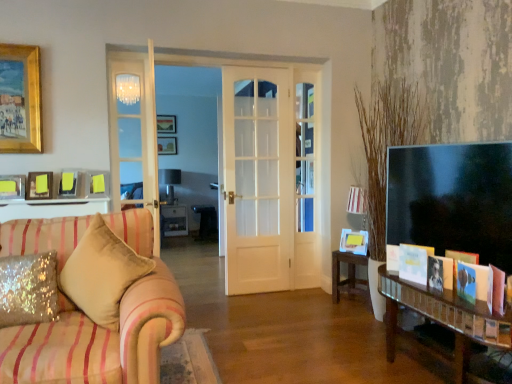
Find the location of `wooden table at center, which ranks as the second table in back-to-front order`. wooden table at center, which ranks as the second table in back-to-front order is located at coordinates pos(348,276).

Measure the distance between point (406, 247) and camera.

Point (406, 247) and camera are 7.77 feet apart.

Measure the distance between metallic silver lamp at center and camera.

metallic silver lamp at center is 6.96 meters from camera.

This screenshot has height=384, width=512. I want to click on wooden picture frame at upper center, the second picture frame from the left, so click(166, 124).

Describe the element at coordinates (166, 124) in the screenshot. I see `wooden picture frame at upper center, which is the 6th picture frame in bottom-to-top order` at that location.

Locate an element on the screen. velvet beige pillow at left, the 1th pillow viewed from the right is located at coordinates (102, 273).

Where is `matte gold picture frame at upper left, which is the first picture frame from left to right`? Image resolution: width=512 pixels, height=384 pixels. matte gold picture frame at upper left, which is the first picture frame from left to right is located at coordinates (12, 187).

What do you see at coordinates (12, 187) in the screenshot? I see `matte gold picture frame at upper left, positioned as the sixth picture frame in right-to-left order` at bounding box center [12, 187].

Where is `matte yellow picture frame at upper left, which is counted as the second picture frame, starting from the right`? matte yellow picture frame at upper left, which is counted as the second picture frame, starting from the right is located at coordinates (72, 184).

Is matte gold picture frame at upper left, positioned as the sixth picture frame in right-to-left order, shorter than white paper at right, marked as the 1th book in a back-to-front arrangement?

Yes.

Is matte gold picture frame at upper left, acting as the 6th picture frame starting from the back, looking in the opposite direction of white paper at right, marked as the 1th book in a back-to-front arrangement?

matte gold picture frame at upper left, acting as the 6th picture frame starting from the back, is not turned away from white paper at right, marked as the 1th book in a back-to-front arrangement.

From a real-world perspective, count 1st picture frames upward from the white paper at right, marked as the 1th book in a back-to-front arrangement, and point to it. Please provide its 2D coordinates.

[(12, 187)]

Visually, is white paper card at lower right, which ranks as the 2th book in back-to-front order, positioned to the left or to the right of glittery sequined pillow at lower left, the second pillow in the right-to-left sequence?

In the image, white paper card at lower right, which ranks as the 2th book in back-to-front order, appears on the right side of glittery sequined pillow at lower left, the second pillow in the right-to-left sequence.

Does white paper card at lower right, which ranks as the 2th book in back-to-front order, have a lesser height compared to glittery sequined pillow at lower left, which ranks as the 1th pillow in left-to-right order?

Indeed, white paper card at lower right, which ranks as the 2th book in back-to-front order, has a lesser height compared to glittery sequined pillow at lower left, which ranks as the 1th pillow in left-to-right order.

From the image's perspective, which one is positioned lower, white paper card at lower right, marked as the second book in a front-to-back arrangement, or glittery sequined pillow at lower left, which ranks as the 1th pillow in left-to-right order?

glittery sequined pillow at lower left, which ranks as the 1th pillow in left-to-right order, appears lower in the image.

From the picture: How different are the orientations of white paper card at lower right, marked as the second book in a front-to-back arrangement, and glittery sequined pillow at lower left, the second pillow in the right-to-left sequence, in degrees?

white paper card at lower right, marked as the second book in a front-to-back arrangement, and glittery sequined pillow at lower left, the second pillow in the right-to-left sequence, are facing 64.1 degrees away from each other.

This screenshot has width=512, height=384. Find the location of `the 1st pillow in front when counting from the white glossy cabinet at center, which is the first table from left to right`. the 1st pillow in front when counting from the white glossy cabinet at center, which is the first table from left to right is located at coordinates tap(28, 289).

Considering the sizes of white glossy cabinet at center, which ranks as the 2th table in front-to-back order, and glittery sequined pillow at lower left, the second pillow in the right-to-left sequence, in the image, is white glossy cabinet at center, which ranks as the 2th table in front-to-back order, taller or shorter than glittery sequined pillow at lower left, the second pillow in the right-to-left sequence,?

Considering their sizes, white glossy cabinet at center, which ranks as the 2th table in front-to-back order, has more height than glittery sequined pillow at lower left, the second pillow in the right-to-left sequence.

Would you consider wooden picture frame at upper center, positioned as the 5th picture frame in right-to-left order, to be distant from white glossy cabinet at center, which ranks as the 2th table in front-to-back order?

Absolutely, wooden picture frame at upper center, positioned as the 5th picture frame in right-to-left order, is distant from white glossy cabinet at center, which ranks as the 2th table in front-to-back order.

Considering the points (168, 130) and (185, 217), which point is in front, point (168, 130) or point (185, 217)?

Point (185, 217)

Is wooden picture frame at upper center, positioned as the 5th picture frame in right-to-left order, inside or outside of white glossy cabinet at center, which is the first table from left to right?

wooden picture frame at upper center, positioned as the 5th picture frame in right-to-left order, is outside white glossy cabinet at center, which is the first table from left to right.

Between wooden picture frame at upper center, which is the 6th picture frame in bottom-to-top order, and white glossy cabinet at center, which is counted as the 1th table, starting from the back, which one has less height?

wooden picture frame at upper center, which is the 6th picture frame in bottom-to-top order.

How different are the orientations of yellow paper at right, which is the 6th picture frame from top to bottom, and matte pink book at lower right, marked as the first book in a front-to-back arrangement, in degrees?

The facing directions of yellow paper at right, which is the 6th picture frame from top to bottom, and matte pink book at lower right, marked as the first book in a front-to-back arrangement, are 72.8 degrees apart.

Can you confirm if yellow paper at right, which appears as the 1th picture frame when viewed from the right, is positioned to the left of matte pink book at lower right, marked as the first book in a front-to-back arrangement?

Indeed, yellow paper at right, which appears as the 1th picture frame when viewed from the right, is positioned on the left side of matte pink book at lower right, marked as the first book in a front-to-back arrangement.

Is matte pink book at lower right, marked as the third book in a back-to-front arrangement, inside yellow paper at right, which is the 3th picture frame from back to front?

No, matte pink book at lower right, marked as the third book in a back-to-front arrangement, is not inside yellow paper at right, which is the 3th picture frame from back to front.

Consider the image. Can you confirm if yellow paper at right, which is the 6th picture frame from top to bottom, is bigger than matte pink book at lower right, marked as the third book in a back-to-front arrangement?

Indeed, yellow paper at right, which is the 6th picture frame from top to bottom, has a larger size compared to matte pink book at lower right, marked as the third book in a back-to-front arrangement.

Is white paper at right, marked as the 1th book in a back-to-front arrangement, at the back of metallic silver lamp at center?

That's not correct — metallic silver lamp at center is not looking away from white paper at right, marked as the 1th book in a back-to-front arrangement.

Considering the sizes of objects metallic silver lamp at center and white paper at right, marked as the 1th book in a back-to-front arrangement, in the image provided, who is shorter, metallic silver lamp at center or white paper at right, marked as the 1th book in a back-to-front arrangement,?

white paper at right, marked as the 1th book in a back-to-front arrangement, is shorter.

From a real-world perspective, is metallic silver lamp at center on white paper at right, which is the 3th book from front to back?

Indeed, from a real-world perspective, metallic silver lamp at center stands above white paper at right, which is the 3th book from front to back.

Does metallic silver lamp at center have a greater width compared to white paper at right, marked as the 1th book in a back-to-front arrangement?

Correct, the width of metallic silver lamp at center exceeds that of white paper at right, marked as the 1th book in a back-to-front arrangement.

Does point (35, 175) appear closer or farther from the camera than point (184, 217)?

Clearly, point (35, 175) is closer to the camera than point (184, 217).

Does yellow paper at upper left, acting as the 3th picture frame starting from the bottom, have a smaller size compared to white glossy cabinet at center, which is counted as the 1th table, starting from the back?

Yes, yellow paper at upper left, acting as the 3th picture frame starting from the bottom, is smaller than white glossy cabinet at center, which is counted as the 1th table, starting from the back.

Is yellow paper at upper left, the 2th picture frame in the front-to-back sequence, spatially inside white glossy cabinet at center, which is counted as the 1th table, starting from the back, or outside of it?

yellow paper at upper left, the 2th picture frame in the front-to-back sequence, lies outside white glossy cabinet at center, which is counted as the 1th table, starting from the back.

I want to click on the 1st book to the right of the matte gold picture frame at upper left, which is the first picture frame from left to right, starting your count from the anchor, so (x=392, y=258).

Where is `pillow that is the 1st one when counting forward from the white paper card at lower right, marked as the second book in a front-to-back arrangement`? The image size is (512, 384). pillow that is the 1st one when counting forward from the white paper card at lower right, marked as the second book in a front-to-back arrangement is located at coordinates (28, 289).

When comparing their distances from matte pink book at lower right, marked as the third book in a back-to-front arrangement, does white paper at right, which is the 3th book from front to back, or white paper card at lower right, marked as the second book in a front-to-back arrangement, seem closer?

The object closer to matte pink book at lower right, marked as the third book in a back-to-front arrangement, is white paper card at lower right, marked as the second book in a front-to-back arrangement.

Considering their positions, is yellow paper at right, which ranks as the sixth picture frame in left-to-right order, positioned further to matte pink book at lower right, marked as the first book in a front-to-back arrangement, than wooden picture frame at center, which ranks as the 5th picture frame in bottom-to-top order?

The object further to matte pink book at lower right, marked as the first book in a front-to-back arrangement, is wooden picture frame at center, which ranks as the 5th picture frame in bottom-to-top order.

Looking at the image, which one is located further to matte gold picture frame at upper left, the second picture frame in the bottom-to-top sequence, yellow paper at upper left, the 2th picture frame in the front-to-back sequence, or matte yellow picture frame at upper left, the 5th picture frame in the left-to-right sequence?

The object further to matte gold picture frame at upper left, the second picture frame in the bottom-to-top sequence, is matte yellow picture frame at upper left, the 5th picture frame in the left-to-right sequence.

Looking at the image, which one is located further to glittery sequined pillow at lower left, which ranks as the 1th pillow in left-to-right order, wooden table at center, which appears as the 2th table when viewed from the left, or matte pink book at lower right, marked as the third book in a back-to-front arrangement?

wooden table at center, which appears as the 2th table when viewed from the left, is further to glittery sequined pillow at lower left, which ranks as the 1th pillow in left-to-right order.

Which object lies nearer to the anchor point wooden table at center, which appears as the 2th table when viewed from the left, yellow paper at upper left, which is the 5th picture frame in back-to-front order, or glittery sequined pillow at lower left, which ranks as the 1th pillow in left-to-right order?

Among the two, glittery sequined pillow at lower left, which ranks as the 1th pillow in left-to-right order, is located nearer to wooden table at center, which appears as the 2th table when viewed from the left.

Considering their positions, is white glossy cabinet at center, the 2th table in the right-to-left sequence, positioned closer to metallic silver lamp at center than matte yellow picture frame at upper left, which appears as the 4th picture frame when ordered from the bottom?

white glossy cabinet at center, the 2th table in the right-to-left sequence, is closer to metallic silver lamp at center.

From the image, which object appears to be nearer to white paper card at lower right, marked as the second book in a front-to-back arrangement, yellow paper at right, which is counted as the 1th picture frame, starting from the bottom, or white paper at right, marked as the 1th book in a back-to-front arrangement?

white paper at right, marked as the 1th book in a back-to-front arrangement, is closer to white paper card at lower right, marked as the second book in a front-to-back arrangement.

Based on their spatial positions, is wooden picture frame at center, the 2th picture frame when ordered from top to bottom, or yellow paper at right, which is the 6th picture frame from top to bottom, further from glittery sequined pillow at lower left, the second pillow in the right-to-left sequence?

wooden picture frame at center, the 2th picture frame when ordered from top to bottom, is positioned further to the anchor glittery sequined pillow at lower left, the second pillow in the right-to-left sequence.

The image size is (512, 384). In order to click on table positioned between wooden table at center, which appears as the 2th table when viewed from the left, and wooden picture frame at upper center, which is the 6th picture frame in bottom-to-top order, from near to far in this screenshot , I will do `click(174, 220)`.

The image size is (512, 384). What are the coordinates of `picture frame between velvet beige pillow at left, the 1th pillow viewed from the right, and white paper card at lower right, which ranks as the 2th book in back-to-front order, in the horizontal direction` in the screenshot? It's located at (354, 241).

Locate an element on the screen. The image size is (512, 384). book between white paper card at lower right, which ranks as the 2th book in back-to-front order, and wooden picture frame at upper center, the second picture frame from the left, in the front-back direction is located at coordinates (392, 258).

You are a GUI agent. You are given a task and a screenshot of the screen. Output one action in this format:
    pyautogui.click(x=<x>, y=<y>)
    Task: Click on the lamp located between yellow paper at right, which is the 6th picture frame from top to bottom, and wooden picture frame at upper center, which appears as the first picture frame when viewed from the top, in the depth direction
    Image resolution: width=512 pixels, height=384 pixels.
    Given the screenshot: What is the action you would take?
    pyautogui.click(x=169, y=182)